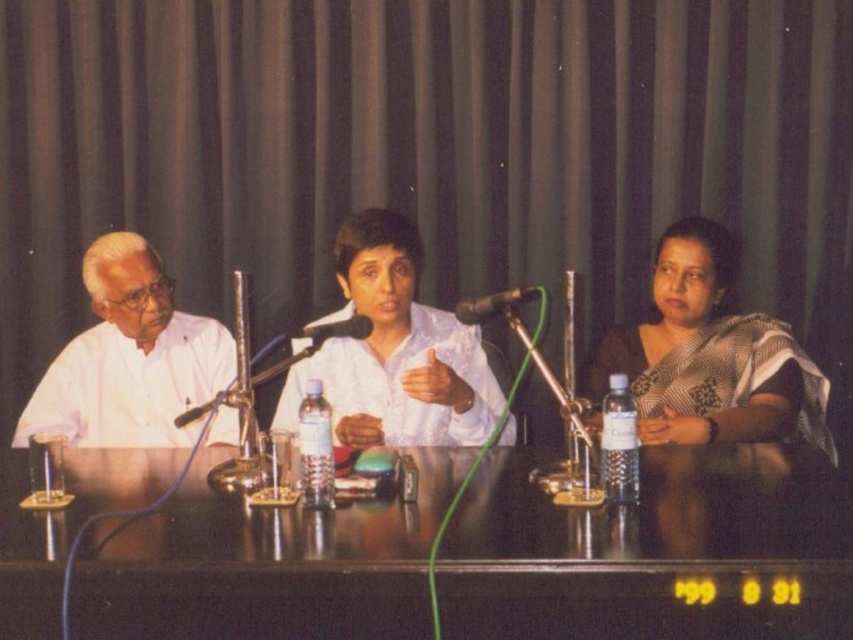
Question: Which point is closer to the camera?

Choices:
 (A) (476, 372)
 (B) (756, 374)
 (C) (163, 512)
 (D) (202, 342)

Answer: (C)

Question: Which object is positioned closest to the white matte shirt at left?

Choices:
 (A) matte black curtain at upper center
 (B) black metallic microphone at center

Answer: (A)

Question: Considering the relative positions of white glossy shirt at center and white matte shirt at left in the image provided, where is white glossy shirt at center located with respect to white matte shirt at left?

Choices:
 (A) above
 (B) below

Answer: (A)

Question: Is white glossy shirt at center in front of black metallic microphone at center?

Choices:
 (A) no
 (B) yes

Answer: (A)

Question: Which is farther from the black matte microphone at center?

Choices:
 (A) white glossy shirt at center
 (B) black metallic microphone at center

Answer: (A)

Question: Does matte black curtain at upper center appear under white matte shirt at left?

Choices:
 (A) yes
 (B) no

Answer: (B)